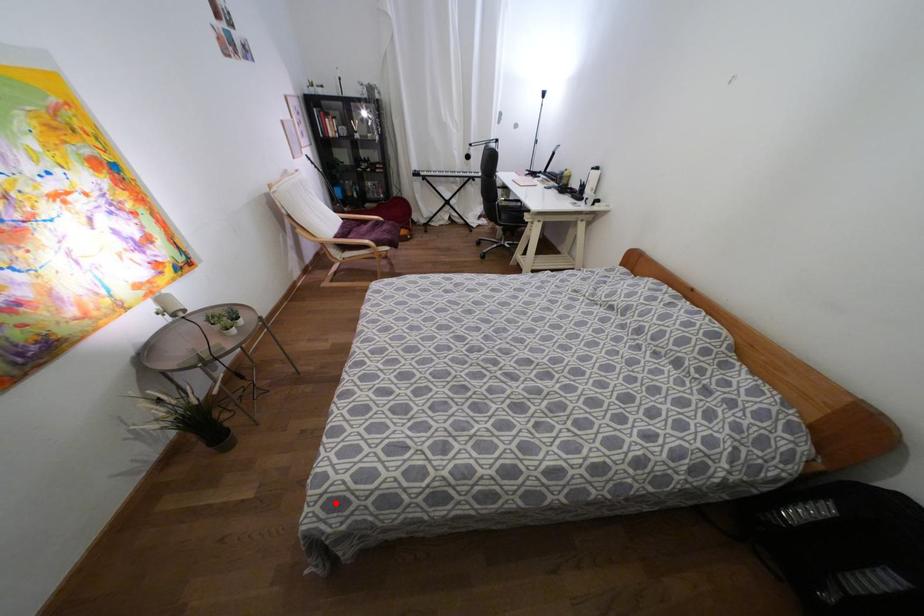
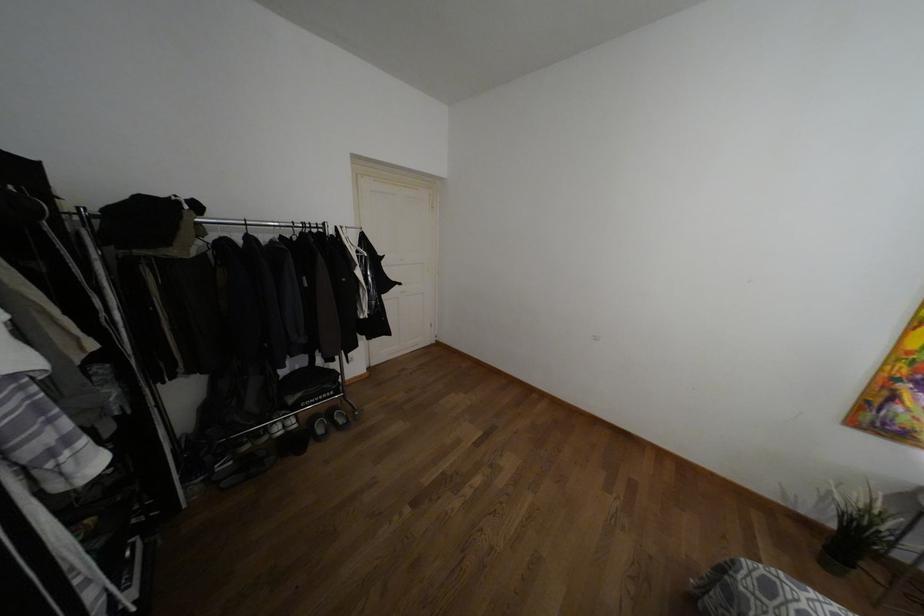
Where in the second image is the point corresponding to the highlighted location from the first image?

(769, 588)